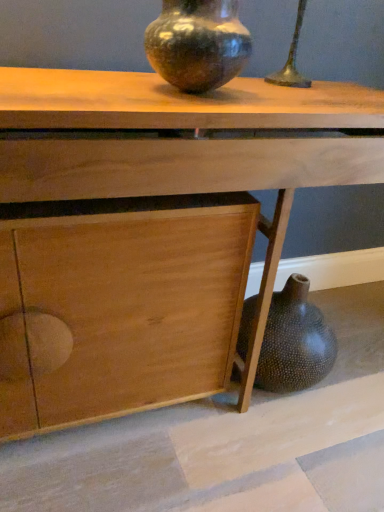
Locate an element on the screen. vacant space to the left of speckled dark brown vase at upper center is located at coordinates [92, 86].